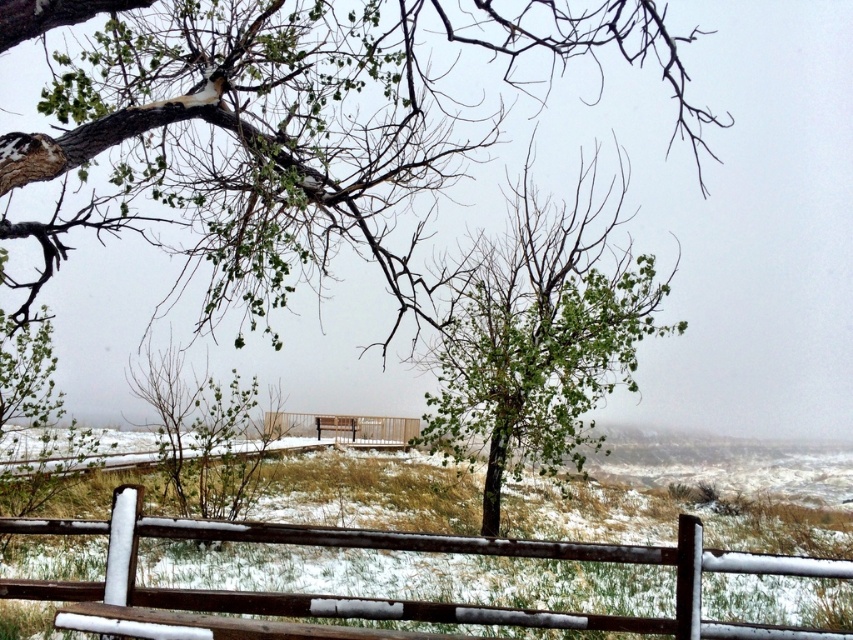
Can you confirm if green leafy tree at center is positioned above rustic wooden fence at lower center?

Yes.

This screenshot has width=853, height=640. Identify the location of green leafy tree at center. (538, 339).

Who is lower down, rustic wooden fence at lower center or brown wooden fence at center?

brown wooden fence at center is lower down.

Can you confirm if rustic wooden fence at lower center is wider than brown wooden fence at center?

Indeed, rustic wooden fence at lower center has a greater width compared to brown wooden fence at center.

The height and width of the screenshot is (640, 853). I want to click on rustic wooden fence at lower center, so click(x=408, y=548).

Does point (86, 88) lie behind point (183, 592)?

Yes.

Does green leafy tree at upper left appear on the left side of rustic wooden fence at lower center?

Correct, you'll find green leafy tree at upper left to the left of rustic wooden fence at lower center.

Is point (338, 195) farther from camera compared to point (183, 636)?

Yes, it is.

At what (x,y) coordinates should I click in order to perform the action: click on green leafy tree at upper left. Please return your answer as a coordinate pair (x, y). The image size is (853, 640). Looking at the image, I should click on (292, 122).